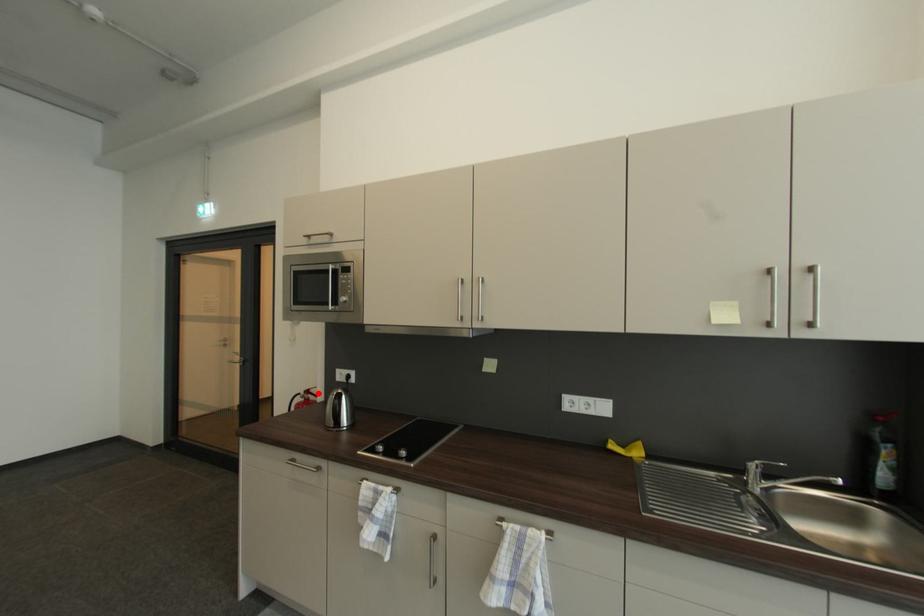
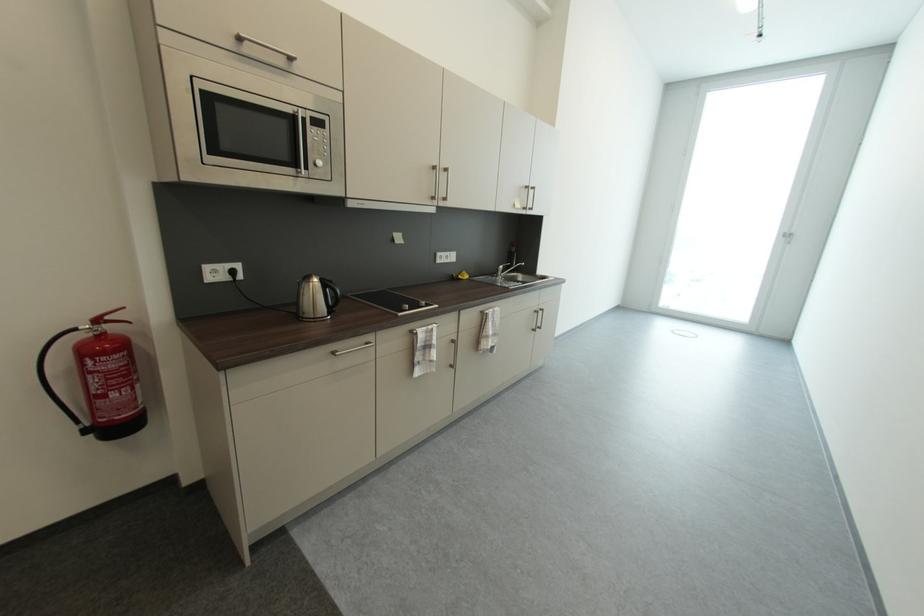
Question: A red point is marked in image1. In image2, is the corresponding 3D point closer to the camera or farther? Reply with the corresponding letter.

Choices:
 (A) The corresponding 3D point is closer.
 (B) The corresponding 3D point is farther.

Answer: (A)